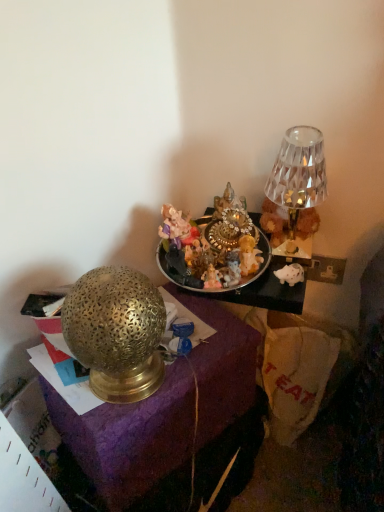
Question: Is the position of shiny metallic tray at center more distant than that of gold textured lamp at left?

Choices:
 (A) yes
 (B) no

Answer: (A)

Question: Can you confirm if shiny metallic tray at center is taller than gold textured lamp at left?

Choices:
 (A) yes
 (B) no

Answer: (B)

Question: Is shiny metallic tray at center positioned beyond the bounds of gold textured lamp at left?

Choices:
 (A) yes
 (B) no

Answer: (A)

Question: From a real-world perspective, is shiny metallic tray at center below gold textured lamp at left?

Choices:
 (A) no
 (B) yes

Answer: (A)

Question: Is shiny metallic tray at center facing away from gold textured lamp at left?

Choices:
 (A) yes
 (B) no

Answer: (B)

Question: Would you say gold textured lamp at left is part of shiny metallic tray at center's contents?

Choices:
 (A) yes
 (B) no

Answer: (B)

Question: Can you confirm if crystal glass lamp at upper right is thinner than gold textured lamp at left?

Choices:
 (A) no
 (B) yes

Answer: (B)

Question: Can you confirm if crystal glass lamp at upper right is taller than gold textured lamp at left?

Choices:
 (A) yes
 (B) no

Answer: (B)

Question: Considering the relative sizes of crystal glass lamp at upper right and gold textured lamp at left in the image provided, is crystal glass lamp at upper right smaller than gold textured lamp at left?

Choices:
 (A) no
 (B) yes

Answer: (B)

Question: Can you confirm if crystal glass lamp at upper right is wider than gold textured lamp at left?

Choices:
 (A) no
 (B) yes

Answer: (A)

Question: From the image's perspective, is crystal glass lamp at upper right on top of gold textured lamp at left?

Choices:
 (A) no
 (B) yes

Answer: (B)

Question: Is crystal glass lamp at upper right positioned in front of gold textured lamp at left?

Choices:
 (A) no
 (B) yes

Answer: (A)

Question: Is shiny metallic tray at center in front of crystal glass lamp at upper right?

Choices:
 (A) no
 (B) yes

Answer: (B)